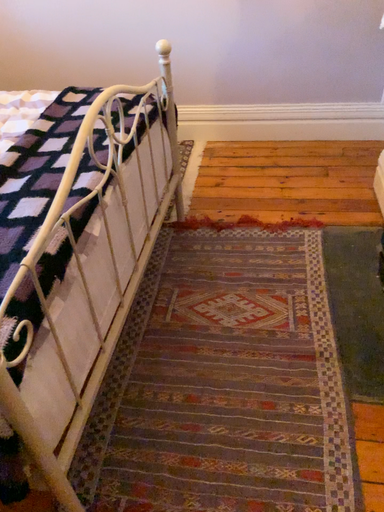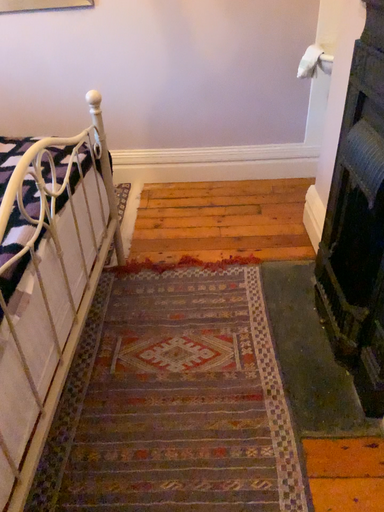
Question: How did the camera likely rotate when shooting the video?

Choices:
 (A) rotated right
 (B) rotated left

Answer: (A)